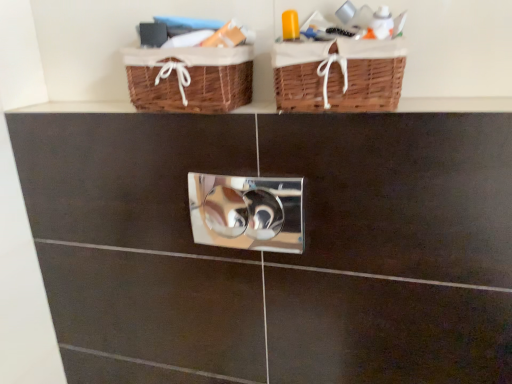
Question: Is the depth of polished silver lock at center less than that of brown wicker baskets at upper center?

Choices:
 (A) yes
 (B) no

Answer: (B)

Question: Does polished silver lock at center turn towards brown wicker baskets at upper center?

Choices:
 (A) yes
 (B) no

Answer: (B)

Question: From the image's perspective, is polished silver lock at center beneath brown wicker baskets at upper center?

Choices:
 (A) no
 (B) yes

Answer: (B)

Question: Is polished silver lock at center shorter than brown wicker baskets at upper center?

Choices:
 (A) yes
 (B) no

Answer: (B)

Question: Is polished silver lock at center at the right side of brown wicker baskets at upper center?

Choices:
 (A) yes
 (B) no

Answer: (A)

Question: From the image's perspective, is brown wicker baskets at upper center positioned above or below woven brown basket at upper center, the 2th basket viewed from the left?

Choices:
 (A) above
 (B) below

Answer: (B)

Question: In terms of height, does brown wicker baskets at upper center look taller or shorter compared to woven brown basket at upper center, the 2th basket viewed from the left?

Choices:
 (A) tall
 (B) short

Answer: (B)

Question: From a real-world perspective, is brown wicker baskets at upper center physically located above or below woven brown basket at upper center, which appears as the first basket when viewed from the right?

Choices:
 (A) below
 (B) above

Answer: (A)

Question: Based on their sizes in the image, would you say brown wicker baskets at upper center is bigger or smaller than woven brown basket at upper center, the 2th basket viewed from the left?

Choices:
 (A) big
 (B) small

Answer: (B)

Question: Is woven brown basket at upper center, the 2th basket when ordered from right to left, situated inside brown wicker baskets at upper center or outside?

Choices:
 (A) inside
 (B) outside

Answer: (B)

Question: From a real-world perspective, is woven brown basket at upper center, which is counted as the first basket, starting from the left, positioned above or below brown wicker baskets at upper center?

Choices:
 (A) below
 (B) above

Answer: (B)

Question: Considering their positions, is woven brown basket at upper center, the 2th basket when ordered from right to left, located in front of or behind brown wicker baskets at upper center?

Choices:
 (A) front
 (B) behind

Answer: (B)

Question: Looking at the image, does woven brown basket at upper center, which is counted as the first basket, starting from the left, seem bigger or smaller compared to brown wicker baskets at upper center?

Choices:
 (A) small
 (B) big

Answer: (B)

Question: Relative to polished silver lock at center, is woven brown basket at upper center, which is counted as the first basket, starting from the left, in front or behind?

Choices:
 (A) behind
 (B) front

Answer: (B)

Question: Considering the positions of woven brown basket at upper center, which is counted as the first basket, starting from the left, and polished silver lock at center in the image, is woven brown basket at upper center, which is counted as the first basket, starting from the left, taller or shorter than polished silver lock at center?

Choices:
 (A) short
 (B) tall

Answer: (A)